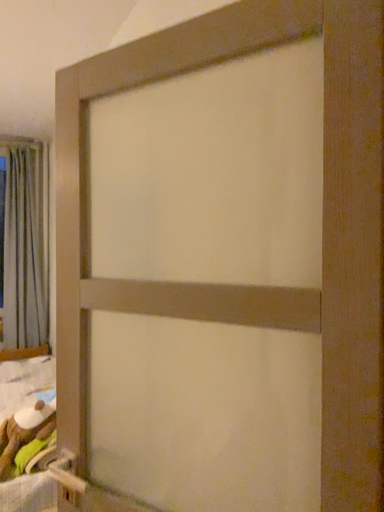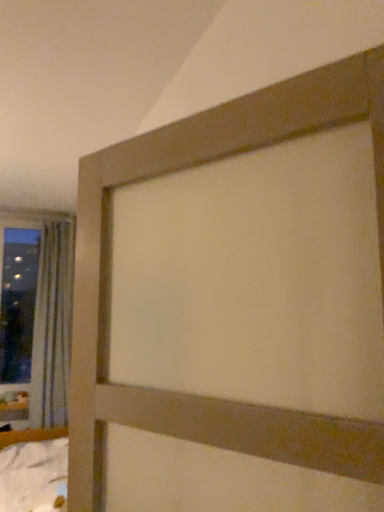
Question: Which way did the camera rotate in the video?

Choices:
 (A) rotated upward
 (B) rotated downward

Answer: (A)